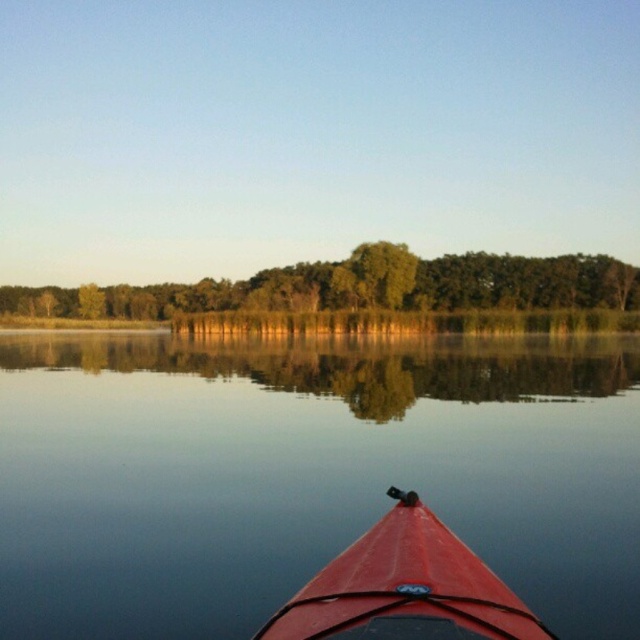
You are in the shiny red canoe at lower center and want to paddle towards the green leafy trees at upper center. Which direction should you paddle to reach them?

You should paddle to the left because the green leafy trees at upper center are positioned to the left of the shiny red canoe at lower center.

You are in a shiny red canoe at lower center and want to look at the reflection of the trees in the smooth water at center. Since the water is so still, will the reflection of the trees be clear?

The smooth water at center has a greater height compared to shiny red canoe at lower center, so the reflection of the trees in the smooth water at center will be clear because calm, still water with sufficient depth can create a mirror effect that reflects images clearly.